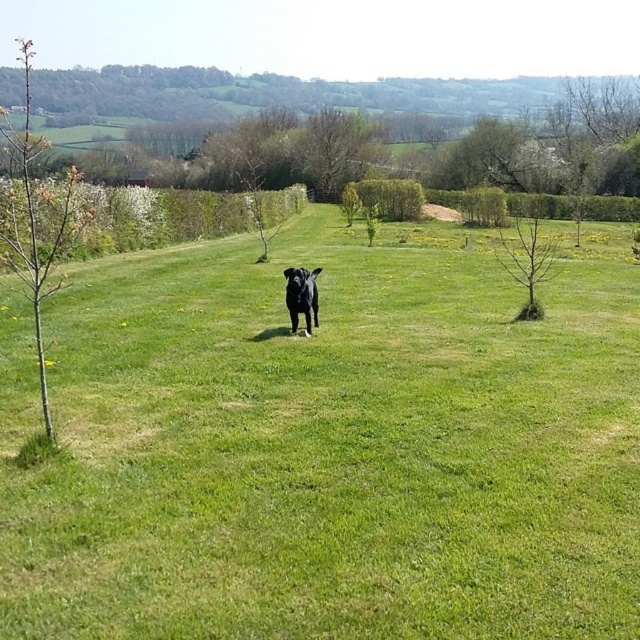
Which is behind, point (509, 244) or point (289, 296)?

The point (509, 244) is more distant.

You are a GUI agent. You are given a task and a screenshot of the screen. Output one action in this format:
    pyautogui.click(x=<x>, y=<y>)
    Task: Click on the bare branch tree at center
    The width and height of the screenshot is (640, 640).
    Given the screenshot: What is the action you would take?
    pyautogui.click(x=528, y=260)

What are the coordinates of `bare branch tree at center` in the screenshot? It's located at (528, 260).

Can you confirm if green leafy tree at left is bigger than black glossy dog at center?

Yes, green leafy tree at left is bigger than black glossy dog at center.

Is green leafy tree at left to the right of black glossy dog at center from the viewer's perspective?

In fact, green leafy tree at left is to the left of black glossy dog at center.

Is point (44, 401) farther from viewer compared to point (296, 266)?

That is False.

The width and height of the screenshot is (640, 640). Identify the location of green leafy tree at left. (36, 220).

Who is positioned more to the right, green leafy tree at left or bare branch tree at center?

From the viewer's perspective, bare branch tree at center appears more on the right side.

Measure the distance between green leafy tree at left and camera.

green leafy tree at left is 3.72 meters away from camera.

Is point (52, 440) more distant than point (554, 244)?

No.

Find the location of `green leafy tree at left`. green leafy tree at left is located at coordinates (36, 220).